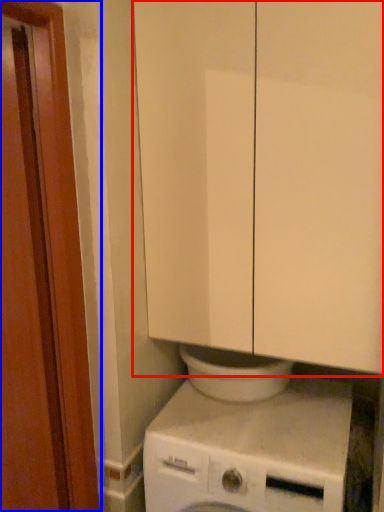
Question: Which object appears farthest to the camera in this image, cabinetry (highlighted by a red box) or screen door (highlighted by a blue box)?

Choices:
 (A) cabinetry
 (B) screen door

Answer: (A)